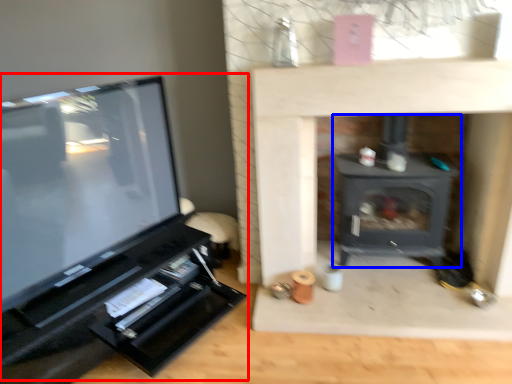
Question: Which object is further to the camera taking this photo, entertainment center (highlighted by a red box) or wood burning stove (highlighted by a blue box)?

Choices:
 (A) entertainment center
 (B) wood burning stove

Answer: (B)